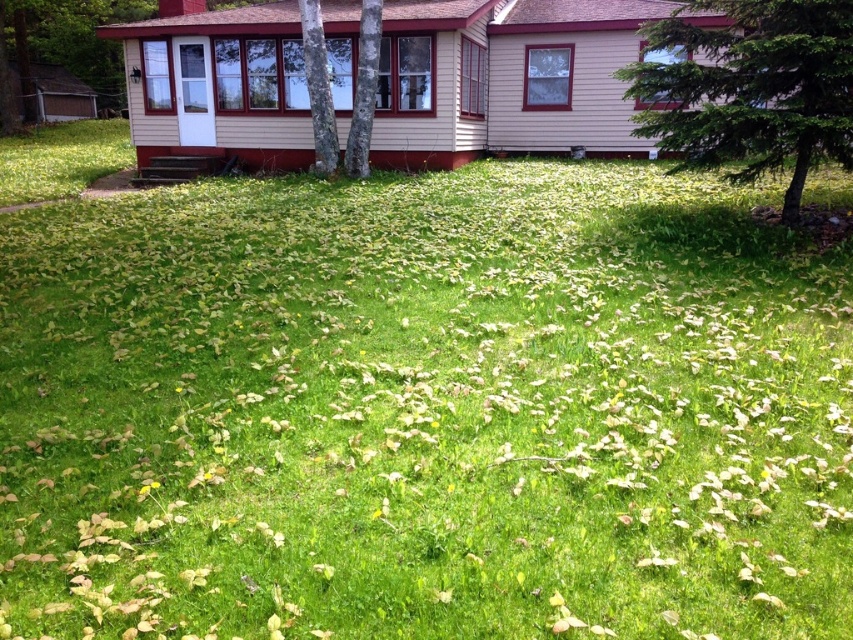
Question: From the image, what is the correct spatial relationship of green leafy tree at center in relation to smooth bark tree at center?

Choices:
 (A) above
 (B) below

Answer: (B)

Question: Among these points, which one is farthest from the camera?

Choices:
 (A) (328, 74)
 (B) (775, 60)

Answer: (A)

Question: Which of the following is the closest to the observer?

Choices:
 (A) (718, 132)
 (B) (357, 115)
 (C) (321, 166)

Answer: (A)

Question: From the image, what is the correct spatial relationship of smooth bark tree at center in relation to smooth gray bark at center?

Choices:
 (A) below
 (B) above

Answer: (B)

Question: Which of the following is the farthest from the observer?

Choices:
 (A) smooth gray bark at center
 (B) green leafy tree at center

Answer: (A)

Question: Is green leafy tree at center bigger than smooth gray bark at center?

Choices:
 (A) yes
 (B) no

Answer: (A)